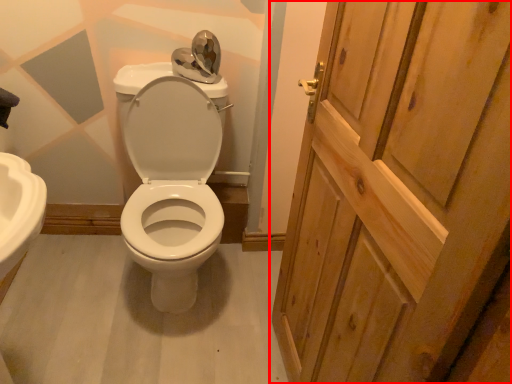
Question: In this image, where is door (annotated by the red box) located relative to porcelain?

Choices:
 (A) left
 (B) right

Answer: (B)